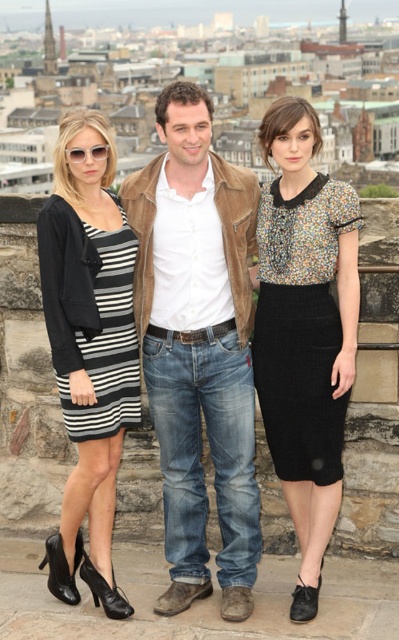
Question: Does multicolored knit top at center have a larger size compared to matte black sunglasses at upper left?

Choices:
 (A) yes
 (B) no

Answer: (A)

Question: Is striped cotton dress at center smaller than matte black sunglasses at upper left?

Choices:
 (A) no
 (B) yes

Answer: (A)

Question: Which point is closer to the camera taking this photo?

Choices:
 (A) (108, 134)
 (B) (339, 404)
 (C) (120, 237)
 (D) (302, 449)

Answer: (B)

Question: Does suede jacket at center have a lesser width compared to multicolored knit top at center?

Choices:
 (A) yes
 (B) no

Answer: (B)

Question: Which object is closer to the camera taking this photo?

Choices:
 (A) striped cotton dress at center
 (B) suede jacket at center
 (C) striped fabric dress at left

Answer: (A)

Question: Which of these objects is positioned farthest from the suede jacket at center?

Choices:
 (A) black and white striped dress at left
 (B) multicolored knit top at center
 (C) matte black sunglasses at upper left
 (D) striped fabric dress at left

Answer: (A)